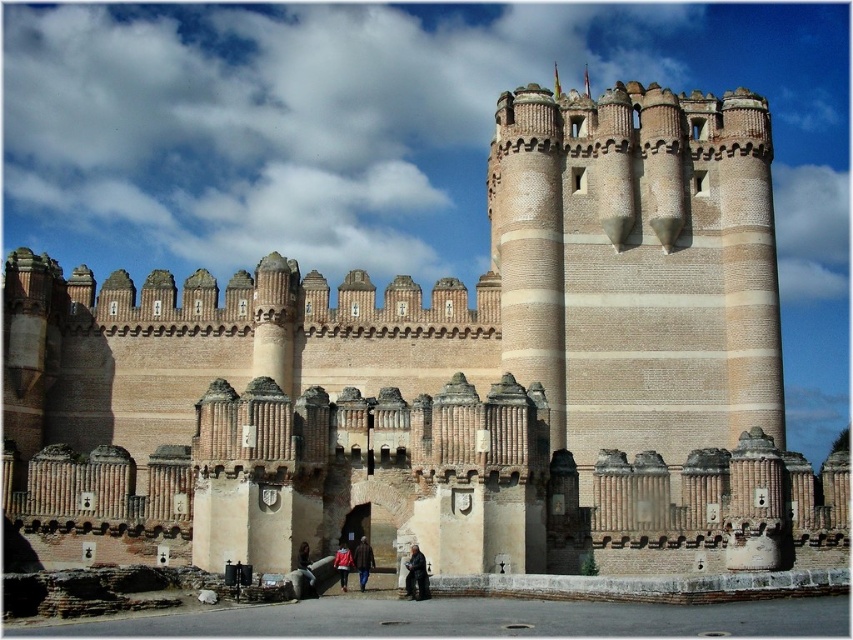
You are a tour guide explaining the castle to visitors. You notice two jackets left behind on a bench in the courtyard. The jackets are the dark brown leather jacket at lower center and the red jacket at center. Which jacket takes up more space on the bench?

The dark brown leather jacket at lower center is larger in size than the red jacket at center, so it takes up more space on the bench.

You are a tour guide leading visitors around the castle. You notice two jackets displayed in the central hall. The jackets are labeled as the dark brown leather jacket at lower center and the brown leather jacket at center. Which jacket takes up more space in the display area?

The brown leather jacket at center takes up more space than the dark brown leather jacket at lower center because the dark brown leather jacket at lower center occupies less space than brown leather jacket at center.